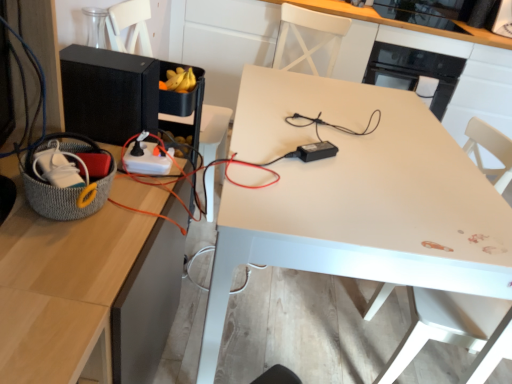
Question: Should I look upward or downward to see black glossy microwave at upper right, marked as the third appliance in a left-to-right arrangement?

Choices:
 (A) down
 (B) up

Answer: (B)

Question: From a real-world perspective, is knitted gray basket at left on top of black matte speaker at left, the 1th appliance from the left?

Choices:
 (A) no
 (B) yes

Answer: (A)

Question: Is black matte speaker at left, the 2th appliance in the bottom-to-top sequence, at the back of knitted gray basket at left?

Choices:
 (A) yes
 (B) no

Answer: (B)

Question: Is knitted gray basket at left oriented towards black matte speaker at left, the 2th appliance viewed from the top?

Choices:
 (A) yes
 (B) no

Answer: (B)

Question: Can you confirm if knitted gray basket at left is shorter than black matte speaker at left, placed as the 2th appliance when sorted from front to back?

Choices:
 (A) no
 (B) yes

Answer: (B)

Question: From a real-world perspective, is knitted gray basket at left under black matte speaker at left, placed as the 2th appliance when sorted from front to back?

Choices:
 (A) no
 (B) yes

Answer: (B)

Question: Is knitted gray basket at left to the left of black matte speaker at left, the 2th appliance in the bottom-to-top sequence, from the viewer's perspective?

Choices:
 (A) no
 (B) yes

Answer: (A)

Question: Is black matte speaker at left, placed as the 2th appliance when sorted from back to front, further to camera compared to white glossy table at center?

Choices:
 (A) yes
 (B) no

Answer: (A)

Question: Considering the relative positions of black matte speaker at left, the 2th appliance in the bottom-to-top sequence, and white glossy table at center in the image provided, is black matte speaker at left, the 2th appliance in the bottom-to-top sequence, in front of white glossy table at center?

Choices:
 (A) no
 (B) yes

Answer: (A)

Question: Considering the relative sizes of black matte speaker at left, arranged as the third appliance when viewed from the right, and white glossy table at center in the image provided, is black matte speaker at left, arranged as the third appliance when viewed from the right, bigger than white glossy table at center?

Choices:
 (A) no
 (B) yes

Answer: (A)

Question: Is black matte speaker at left, arranged as the third appliance when viewed from the right, wider than white glossy table at center?

Choices:
 (A) no
 (B) yes

Answer: (A)

Question: Does black matte speaker at left, the 2th appliance in the bottom-to-top sequence, have a greater height compared to white glossy table at center?

Choices:
 (A) yes
 (B) no

Answer: (B)

Question: Is black matte speaker at left, the 1th appliance from the left, aimed at white glossy table at center?

Choices:
 (A) yes
 (B) no

Answer: (A)

Question: Is black plastic power adapter at center, the second appliance positioned from the right, taller than knitted gray basket at left?

Choices:
 (A) no
 (B) yes

Answer: (A)